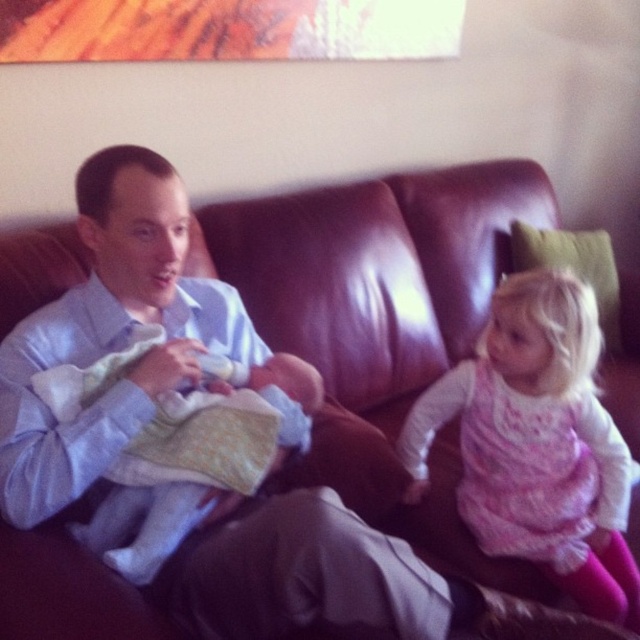
Based on the photo, does pink fluffy dress at right have a lesser height compared to soft white cloth at center?

In fact, pink fluffy dress at right may be taller than soft white cloth at center.

Is point (522, 342) in front of point (163, 548)?

No, it is not.

This screenshot has height=640, width=640. Describe the element at coordinates (538, 444) in the screenshot. I see `pink fluffy dress at right` at that location.

In order to click on pink fluffy dress at right in this screenshot , I will do `click(538, 444)`.